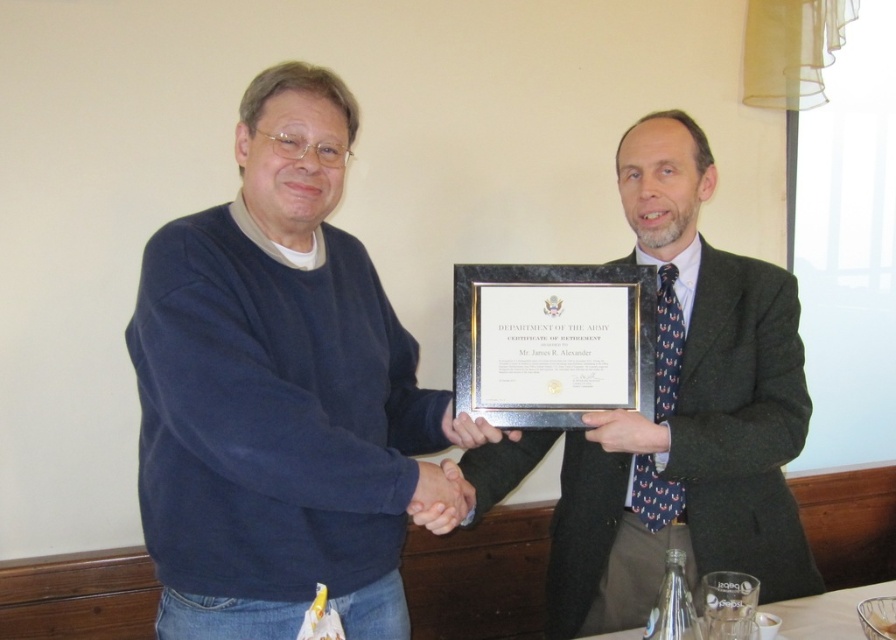
Question: Which object appears closest to the camera in this image?

Choices:
 (A) dark gray suit at center
 (B) matte blue sweater at center

Answer: (B)

Question: Is matte blue sweater at center to the right of dark gray suit at center from the viewer's perspective?

Choices:
 (A) no
 (B) yes

Answer: (A)

Question: Among these points, which one is farthest from the camera?

Choices:
 (A) (677, 541)
 (B) (378, 308)

Answer: (A)

Question: Does matte blue sweater at center come in front of dark gray suit at center?

Choices:
 (A) no
 (B) yes

Answer: (B)

Question: Does matte blue sweater at center appear on the right side of dark gray suit at center?

Choices:
 (A) yes
 (B) no

Answer: (B)

Question: Which object appears closest to the camera in this image?

Choices:
 (A) matte blue sweater at center
 (B) dark gray suit at center

Answer: (A)